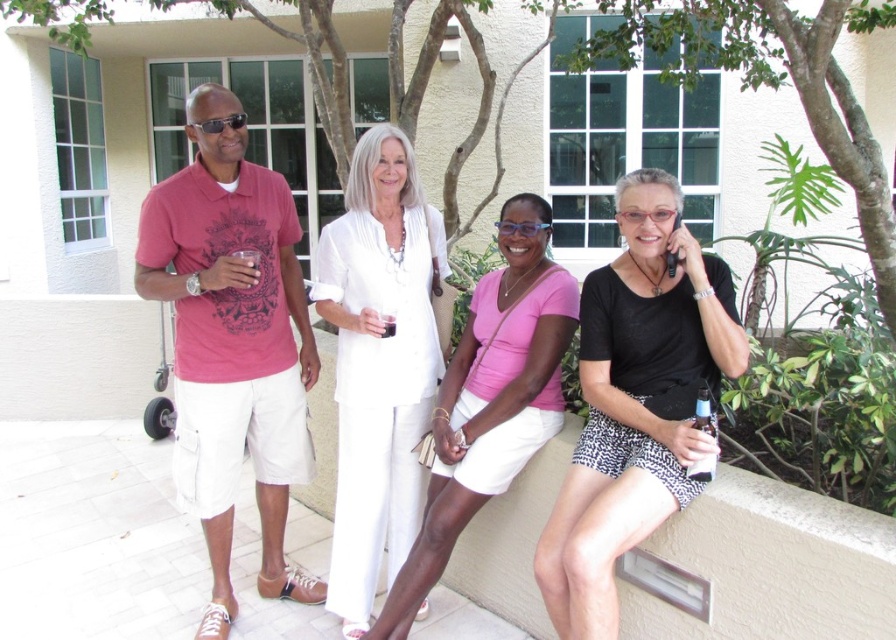
Question: Is black matte shirt at center below clear plastic bottle at lower right?

Choices:
 (A) no
 (B) yes

Answer: (A)

Question: Which point is farther from the camera taking this photo?

Choices:
 (A) (149, 221)
 (B) (705, 472)
 (C) (268, 508)
 (D) (662, 513)

Answer: (C)

Question: Among these points, which one is nearest to the camera?

Choices:
 (A) (202, 404)
 (B) (712, 426)

Answer: (B)

Question: Is matte pink t-shirt at left below clear plastic bottle at lower right?

Choices:
 (A) yes
 (B) no

Answer: (B)

Question: Does matte pink t-shirt at left lie in front of matte pink shirt at left?

Choices:
 (A) yes
 (B) no

Answer: (B)

Question: Which of these objects is positioned farthest from the matte pink shirt at left?

Choices:
 (A) matte black sunglasses at upper left
 (B) white cotton blouse at center
 (C) clear plastic bottle at lower right
 (D) white cotton dress at center

Answer: (C)